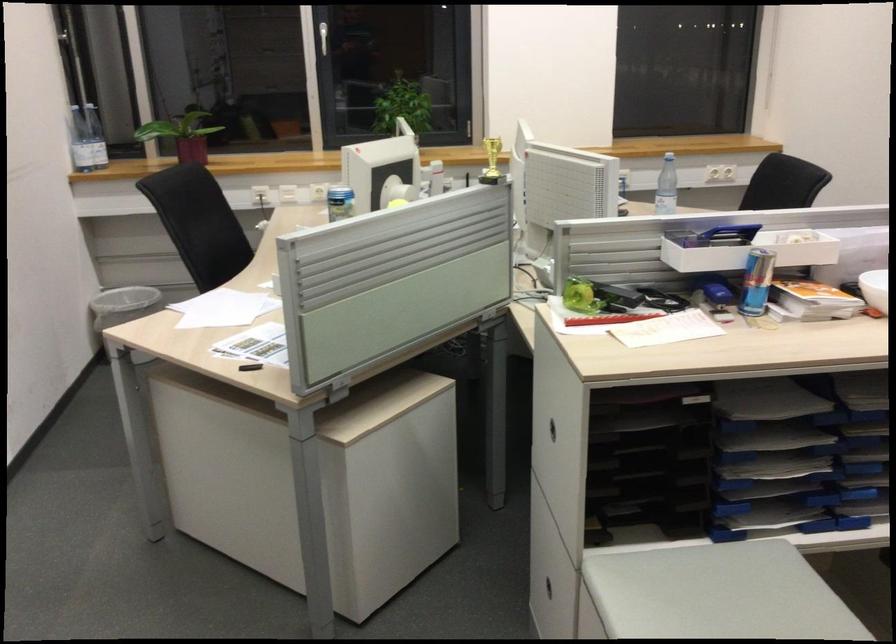
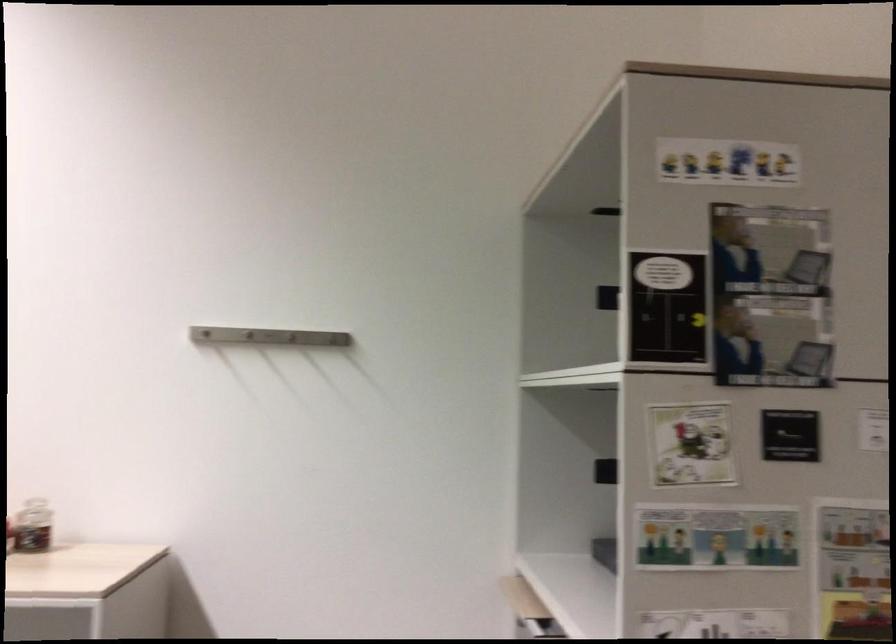
Question: How did the camera likely rotate?

Choices:
 (A) Left
 (B) Right
 (C) Up
 (D) Down

Answer: (B)